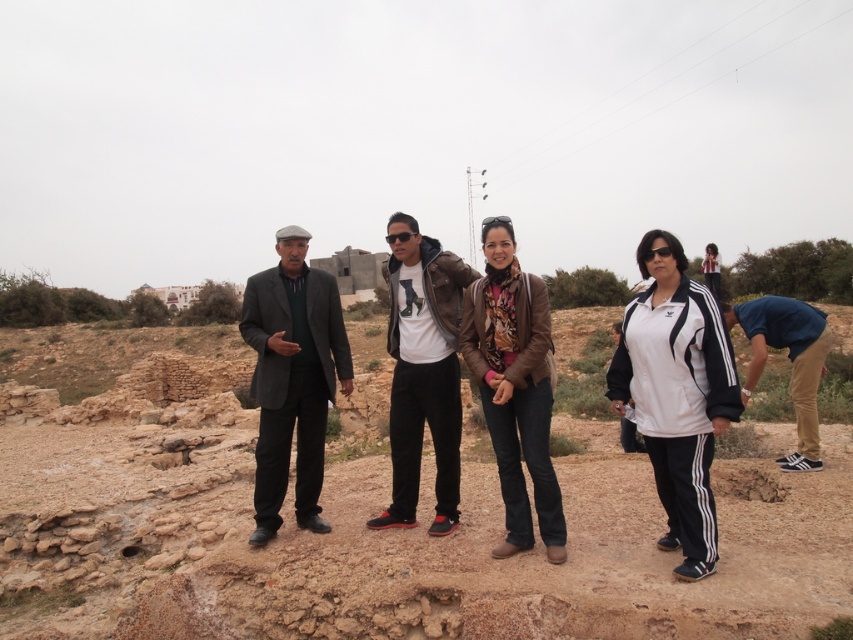
You are a hiker planning to cross the brown dirt field at center and need to know if the matte leather jacket at center is taller than the field. Can you confirm this?

The brown dirt field at center is not as tall as matte leather jacket at center, so yes, the matte leather jacket at center is taller than the brown dirt field at center.